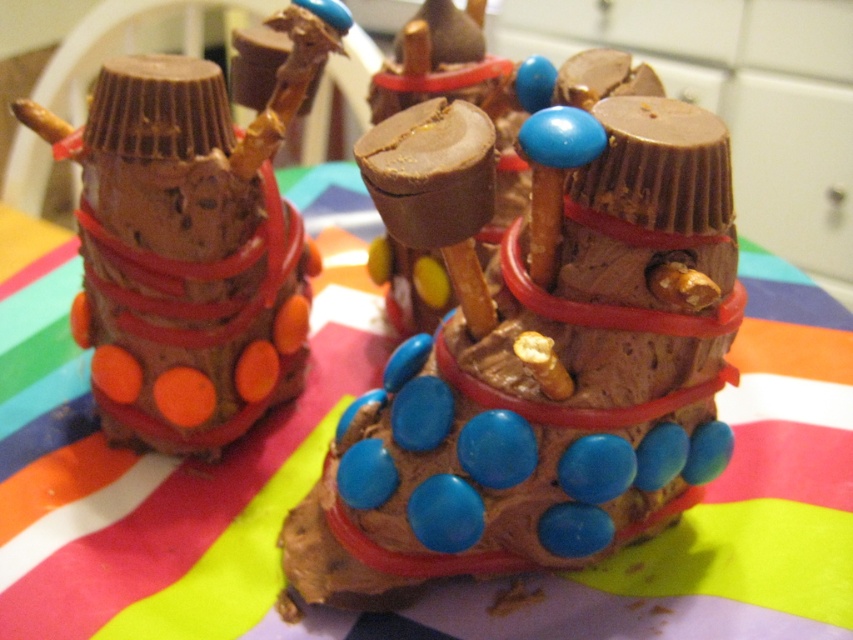
Which is more to the right, blue chocolate candy at center or matte chocolate candy at left?

blue chocolate candy at center is more to the right.

Measure the distance from blue chocolate candy at center to matte chocolate candy at left.

blue chocolate candy at center and matte chocolate candy at left are 22.01 centimeters apart.

This screenshot has width=853, height=640. Describe the element at coordinates (537, 349) in the screenshot. I see `blue chocolate candy at center` at that location.

Identify the location of blue chocolate candy at center. (537, 349).

Who is taller, multicolored fabric at center or matte chocolate candy at left?

Standing taller between the two is multicolored fabric at center.

How much distance is there between multicolored fabric at center and matte chocolate candy at left?

They are 7.53 inches apart.

Between point (721, 483) and point (247, 314), which one is positioned in front?

Positioned in front is point (247, 314).

This screenshot has width=853, height=640. In order to click on multicolored fabric at center in this screenshot , I will do `click(326, 445)`.

Is blue chocolate candy at center shorter than multicolored fabric at center?

Incorrect, blue chocolate candy at center's height does not fall short of multicolored fabric at center's.

Can you confirm if blue chocolate candy at center is positioned to the left of multicolored fabric at center?

Incorrect, blue chocolate candy at center is not on the left side of multicolored fabric at center.

Consider the image. Who is more forward, [384,428] or [201,474]?

Positioned in front is point [384,428].

Locate an element on the screen. blue chocolate candy at center is located at coordinates (537, 349).